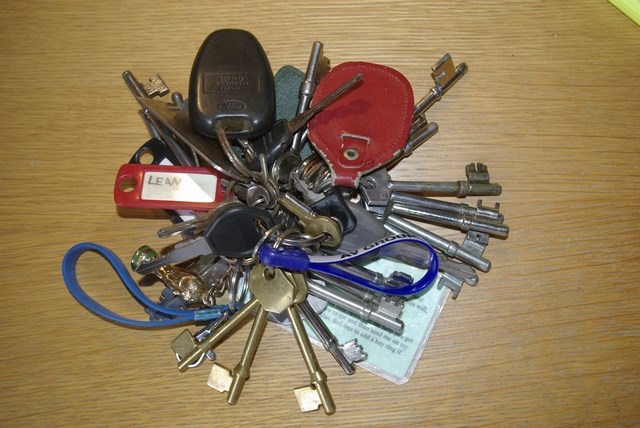
I want to click on wooden surface, so click(538, 188).